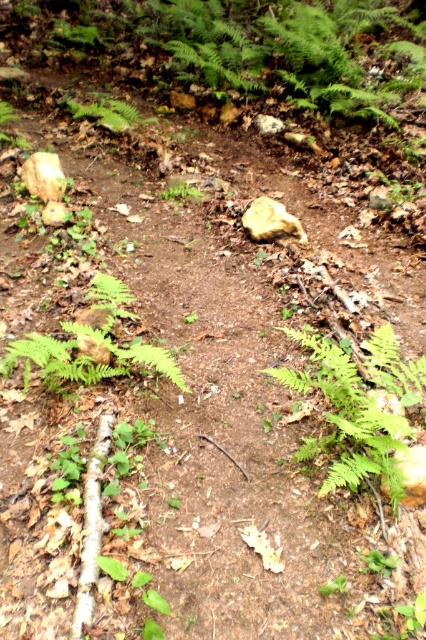
Question: Which of the following is the farthest from the observer?

Choices:
 (A) green matte fern at center
 (B) green leafy fern at center
 (C) green matte fern at upper center

Answer: (C)

Question: Among these objects, which one is nearest to the camera?

Choices:
 (A) green matte fern at upper center
 (B) green matte fern at center
 (C) green leafy fern at center

Answer: (C)

Question: Which is farther from the green leafy fern at center?

Choices:
 (A) green matte fern at center
 (B) green matte fern at upper center

Answer: (B)

Question: Does green matte fern at center appear over green matte fern at upper center?

Choices:
 (A) no
 (B) yes

Answer: (A)

Question: Does green matte fern at center have a smaller size compared to green matte fern at upper center?

Choices:
 (A) no
 (B) yes

Answer: (A)

Question: Is green matte fern at center positioned in front of green matte fern at upper center?

Choices:
 (A) yes
 (B) no

Answer: (A)